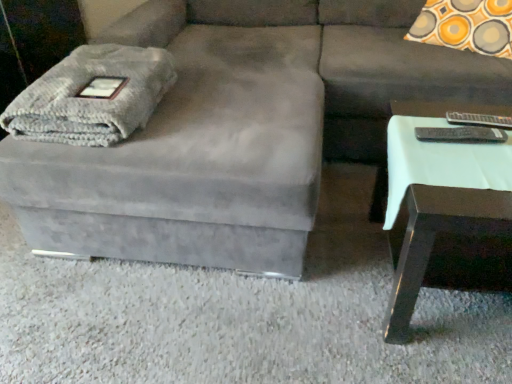
Identify the location of blank space above white glossy side table at right (from a real-world perspective). This screenshot has height=384, width=512. (457, 147).